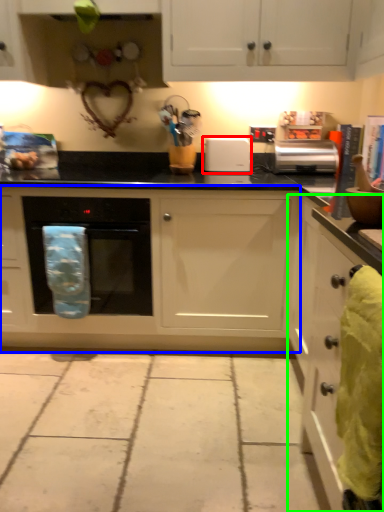
Question: Which object is the farthest from appliance (highlighted by a red box)? Choose among these: cabinetry (highlighted by a blue box) or cabinetry (highlighted by a green box).

Choices:
 (A) cabinetry
 (B) cabinetry

Answer: (B)